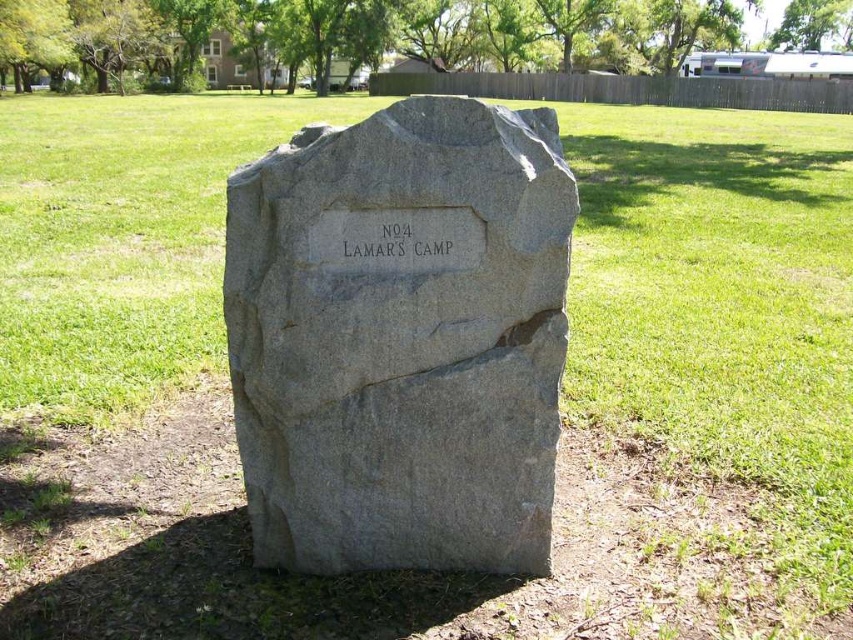
Does gray stone marker at center have a lesser width compared to black stone engraving at center?

In fact, gray stone marker at center might be wider than black stone engraving at center.

Does point (451, 506) lie in front of point (398, 225)?

No, (451, 506) is behind (398, 225).

Image resolution: width=853 pixels, height=640 pixels. Find the location of `gray stone marker at center`. gray stone marker at center is located at coordinates (401, 342).